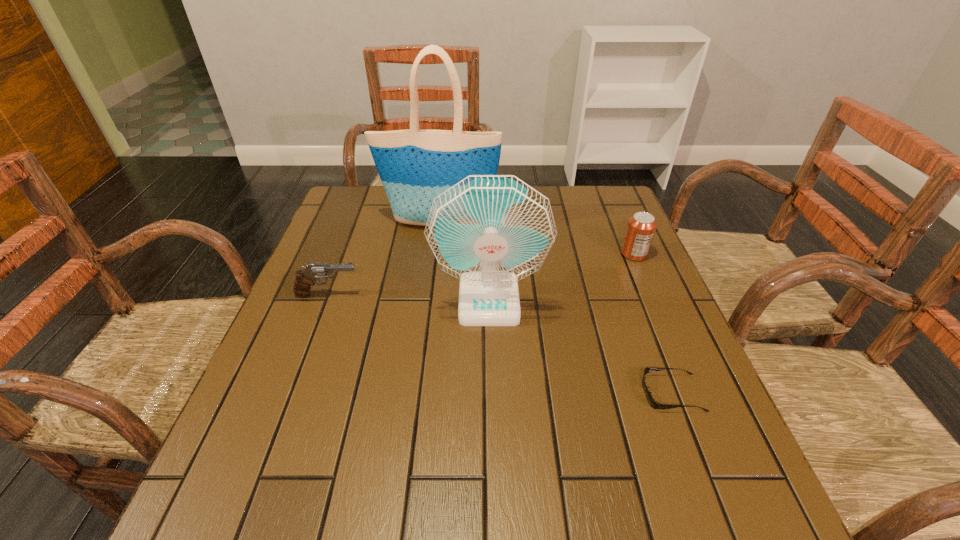
This screenshot has width=960, height=540. In order to click on free space that satisfies the following two spatial constraints: 1. on the front side of the fourth nearest object; 2. on the front-facing side of the shortest object in this screenshot , I will do `click(693, 393)`.